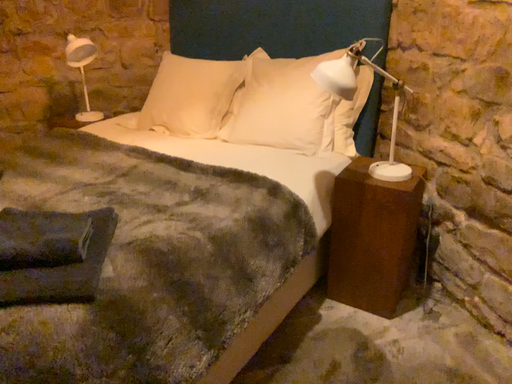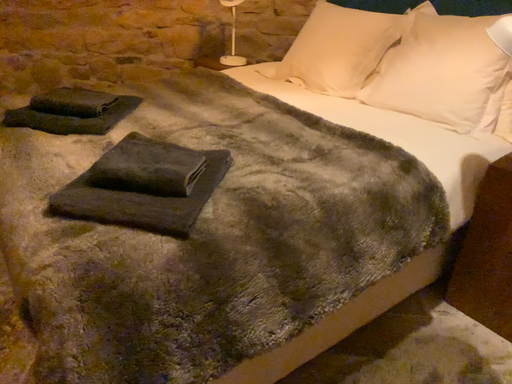
Question: How did the camera likely rotate when shooting the video?

Choices:
 (A) rotated right
 (B) rotated left

Answer: (B)